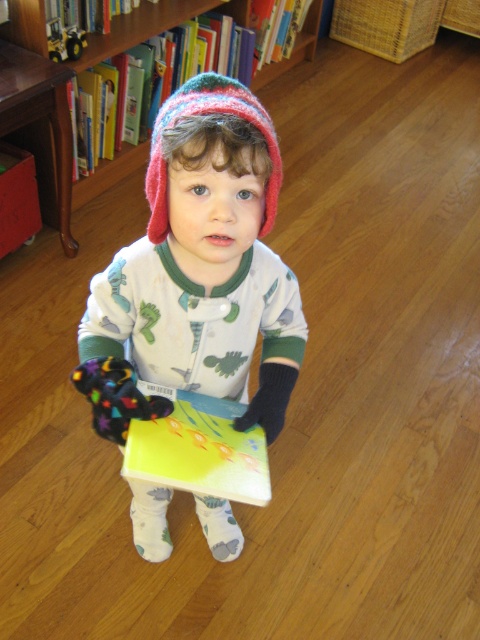
Can you confirm if wooden bookcase at upper center is shorter than yellow paper book at upper center?

No.

Is point (19, 125) farther from camera compared to point (184, 3)?

No, (19, 125) is closer to viewer.

At what (x,y) coordinates should I click in order to perform the action: click on wooden bookcase at upper center. Please return your answer as a coordinate pair (x, y). Image resolution: width=480 pixels, height=640 pixels. Looking at the image, I should click on (152, 24).

Which of these two, wooden bookcase at upper center or knitted woolen hat at center, stands taller?

wooden bookcase at upper center is taller.

From the picture: Between wooden bookcase at upper center and knitted woolen hat at center, which one appears on the right side from the viewer's perspective?

knitted woolen hat at center is more to the right.

Does point (105, 51) come closer to viewer compared to point (208, 83)?

That is False.

Where is `wooden bookcase at upper center`? Image resolution: width=480 pixels, height=640 pixels. wooden bookcase at upper center is located at coordinates (152, 24).

Can you confirm if yellow paper book at upper center is bigger than hardcover book at upper center?

Correct, yellow paper book at upper center is larger in size than hardcover book at upper center.

Between yellow paper book at upper center and hardcover book at upper center, which one appears on the left side from the viewer's perspective?

yellow paper book at upper center is more to the left.

Describe the element at coordinates (151, 26) in the screenshot. I see `yellow paper book at upper center` at that location.

Locate an element on the screen. yellow paper book at upper center is located at coordinates (151, 26).